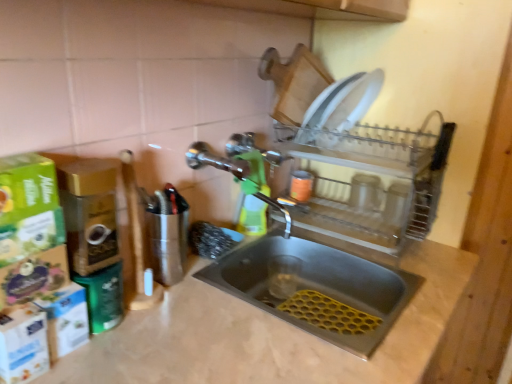
Question: Do you think clear plastic dish rack at upper right is within green plastic spray bottle at center, or outside of it?

Choices:
 (A) inside
 (B) outside

Answer: (B)

Question: Visually, is clear plastic dish rack at upper right positioned to the left or to the right of green plastic spray bottle at center?

Choices:
 (A) left
 (B) right

Answer: (B)

Question: Estimate the real-world distances between objects in this image. Which object is farther from the stainless steel sink at center?

Choices:
 (A) beige marble counter top at center
 (B) green plastic spray bottle at center
 (C) clear plastic dish rack at upper right
 (D) polished chrome tap at center

Answer: (D)

Question: Estimate the real-world distances between objects in this image. Which object is farther from the clear plastic dish rack at upper right?

Choices:
 (A) stainless steel sink at center
 (B) green plastic spray bottle at center
 (C) polished chrome tap at center
 (D) beige marble counter top at center

Answer: (C)